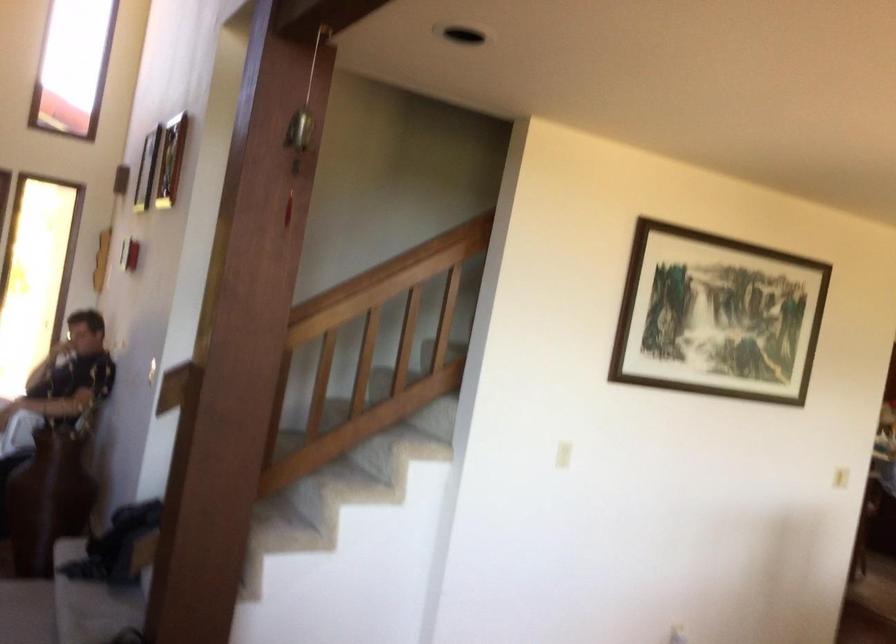
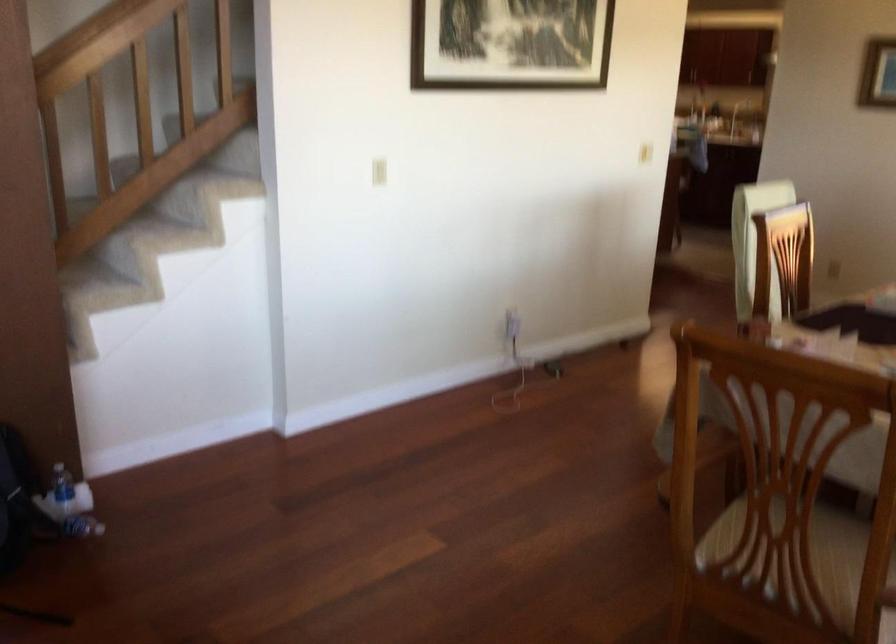
The point at (340, 307) is marked in the first image. Where is the corresponding point in the second image?

(104, 40)